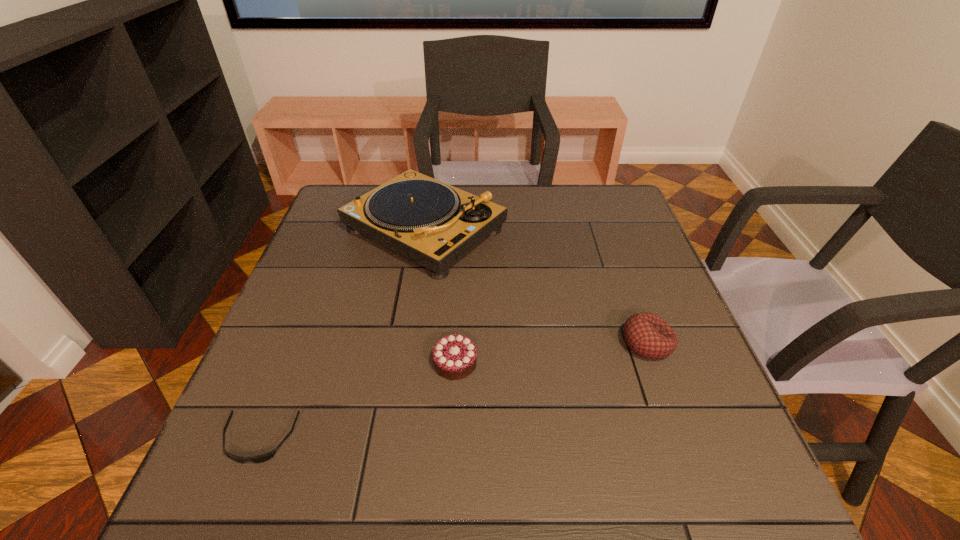
The image size is (960, 540). I want to click on the tallest object, so click(428, 221).

Where is `the farthest object`? Image resolution: width=960 pixels, height=540 pixels. the farthest object is located at coordinates (428, 221).

Image resolution: width=960 pixels, height=540 pixels. Find the location of `the rightmost object`. the rightmost object is located at coordinates pyautogui.click(x=647, y=335).

What are the coordinates of `chocolate cake` in the screenshot? It's located at (454, 356).

This screenshot has height=540, width=960. What are the coordinates of `the nearest object` in the screenshot? It's located at (262, 458).

At what (x,y) coordinates should I click in order to perform the action: click on the shortest object. Please return your answer as a coordinate pair (x, y). This screenshot has height=540, width=960. Looking at the image, I should click on (262, 458).

Find the location of a particular element. vacant space located on the right of the tallest object is located at coordinates (556, 230).

At what (x,y) coordinates should I click in order to perform the action: click on blank area located on the left of the beanbag. Please return your answer as a coordinate pair (x, y). Image resolution: width=960 pixels, height=540 pixels. Looking at the image, I should click on (548, 343).

Find the location of a particular element. This screenshot has height=540, width=960. vacant space located on the left of the third tallest object is located at coordinates (333, 363).

This screenshot has height=540, width=960. In order to click on vacant area situated on the front-facing side of the shortest object in this screenshot , I will do `click(238, 495)`.